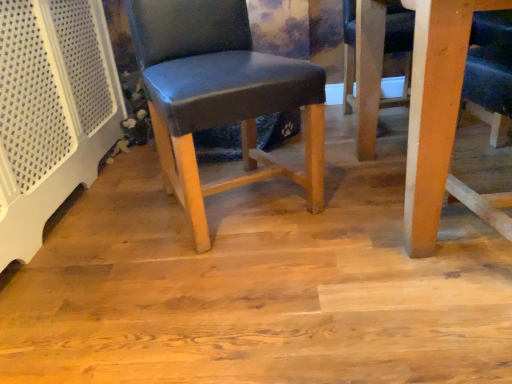
The height and width of the screenshot is (384, 512). Find the location of `vacant area situated below matte blue leather chair at center (from a real-world perspective)`. vacant area situated below matte blue leather chair at center (from a real-world perspective) is located at coordinates (246, 205).